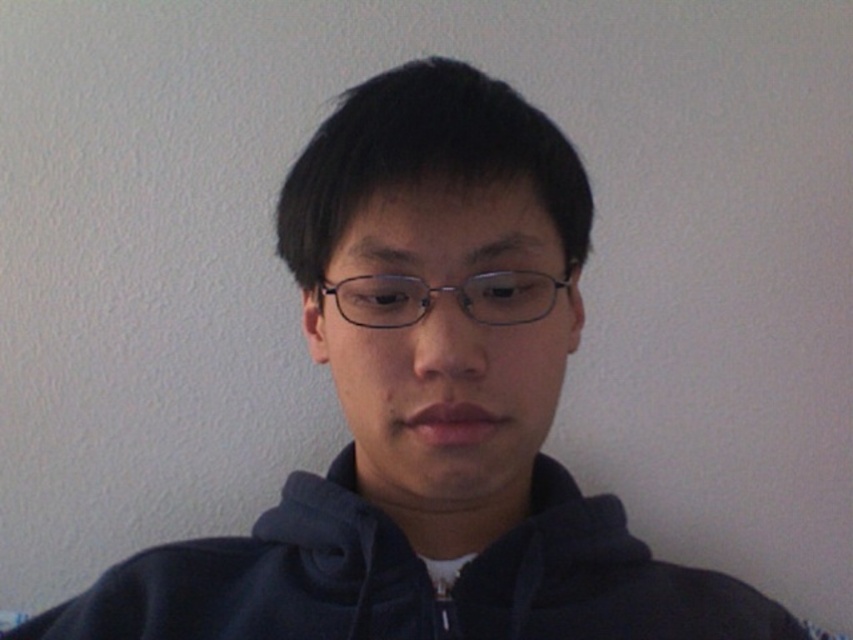
You are a photographer trying to capture a closeup of the clear plastic glasses at center. However, the dark blue fleece sweatshirt at center is blocking your view. Can you adjust your position to see the glasses without moving any objects?

The clear plastic glasses at center is behind the dark blue fleece sweatshirt at center, so you can move your camera position slightly to the side to see around the sweatshirt and capture the glasses without moving any objects.

You are a fashion designer trying to create a new accessory that can be worn with the dark blue fleece sweatshirt at center and the clear plastic glasses at center. Considering their sizes, which item should you design the accessory to complement in terms of width?

The dark blue fleece sweatshirt at center is wider than the clear plastic glasses at center, so the accessory should be designed to complement the width of the dark blue fleece sweatshirt at center.